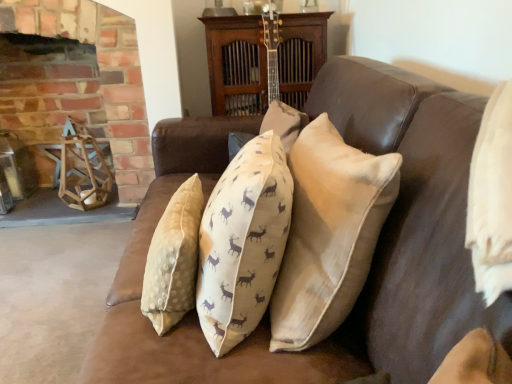
The height and width of the screenshot is (384, 512). Describe the element at coordinates (329, 233) in the screenshot. I see `beige textured pillow at center` at that location.

I want to click on beige textured pillow at center, so click(329, 233).

Measure the distance between point (287, 259) and camera.

They are 33.62 inches apart.

What is the approximate width of brick fireplace at upper left?

16.78 inches.

Describe the element at coordinates (80, 85) in the screenshot. I see `brick fireplace at upper left` at that location.

From the picture: Measure the distance between point (x=123, y=170) and camera.

Point (x=123, y=170) is 2.26 meters from camera.

What are the coordinates of `brick fireplace at upper left` in the screenshot? It's located at (80, 85).

Image resolution: width=512 pixels, height=384 pixels. I want to click on beige textured pillow at center, so click(329, 233).

Visually, is brick fireplace at upper left positioned to the left or to the right of beige textured pillow at center?

Based on their positions, brick fireplace at upper left is located to the left of beige textured pillow at center.

Which is in front, brick fireplace at upper left or beige textured pillow at center?

Positioned in front is beige textured pillow at center.

Which is less distant, (96, 107) or (388, 184)?

Point (96, 107) is positioned farther from the camera compared to point (388, 184).

From the image's perspective, who appears lower, brick fireplace at upper left or beige textured pillow at center?

beige textured pillow at center is shown below in the image.

From a real-world perspective, between brick fireplace at upper left and beige textured pillow at center, who is vertically higher?

From a 3D spatial view, beige textured pillow at center is above.

Which of these two, brick fireplace at upper left or beige textured pillow at center, is wider?

With larger width is brick fireplace at upper left.

Considering the relative sizes of brick fireplace at upper left and beige textured pillow at center in the image provided, is brick fireplace at upper left shorter than beige textured pillow at center?

No, brick fireplace at upper left is not shorter than beige textured pillow at center.

Considering the relative sizes of brick fireplace at upper left and beige textured pillow at center in the image provided, is brick fireplace at upper left bigger than beige textured pillow at center?

Yes, brick fireplace at upper left is bigger than beige textured pillow at center.

Is beige textured pillow at center a part of brick fireplace at upper left?

No, beige textured pillow at center is not a part of brick fireplace at upper left.

Is brick fireplace at upper left not near beige textured pillow at center?

Yes, brick fireplace at upper left and beige textured pillow at center are quite far apart.

Is beige textured pillow at center at the back of brick fireplace at upper left?

brick fireplace at upper left is not turned away from beige textured pillow at center.

Identify the location of pillow located above the brick fireplace at upper left (from a real-world perspective). (329, 233).

Which object is positioned more to the right, beige textured pillow at center or brick fireplace at upper left?

beige textured pillow at center is more to the right.

Is beige textured pillow at center in front of or behind brick fireplace at upper left in the image?

beige textured pillow at center is positioned closer to the viewer than brick fireplace at upper left.

Which is closer, [325,200] or [122,41]?

Point [325,200] is closer to the camera than point [122,41].

From the image's perspective, is beige textured pillow at center on brick fireplace at upper left?

Actually, beige textured pillow at center appears below brick fireplace at upper left in the image.

From a real-world perspective, between beige textured pillow at center and brick fireplace at upper left, who is vertically higher?

beige textured pillow at center.

Which object is thinner, beige textured pillow at center or brick fireplace at upper left?

Thinner between the two is beige textured pillow at center.

In the scene shown: From their relative heights in the image, would you say beige textured pillow at center is taller or shorter than brick fireplace at upper left?

beige textured pillow at center is shorter than brick fireplace at upper left.

Based on the photo, which of these two, beige textured pillow at center or brick fireplace at upper left, is smaller?

Smaller between the two is beige textured pillow at center.

Would you say beige textured pillow at center contains brick fireplace at upper left?

No, brick fireplace at upper left is located outside of beige textured pillow at center.

Is beige textured pillow at center positioned far away from brick fireplace at upper left?

Yes.

Is beige textured pillow at center aimed at brick fireplace at upper left?

No, beige textured pillow at center is not oriented towards brick fireplace at upper left.

This screenshot has width=512, height=384. I want to click on pillow on the right of the brick fireplace at upper left, so click(329, 233).

Where is `fireplace behind the beige textured pillow at center`? The width and height of the screenshot is (512, 384). fireplace behind the beige textured pillow at center is located at coordinates (80, 85).

What are the coordinates of `fireplace that appears on the left of beige textured pillow at center` in the screenshot? It's located at (80, 85).